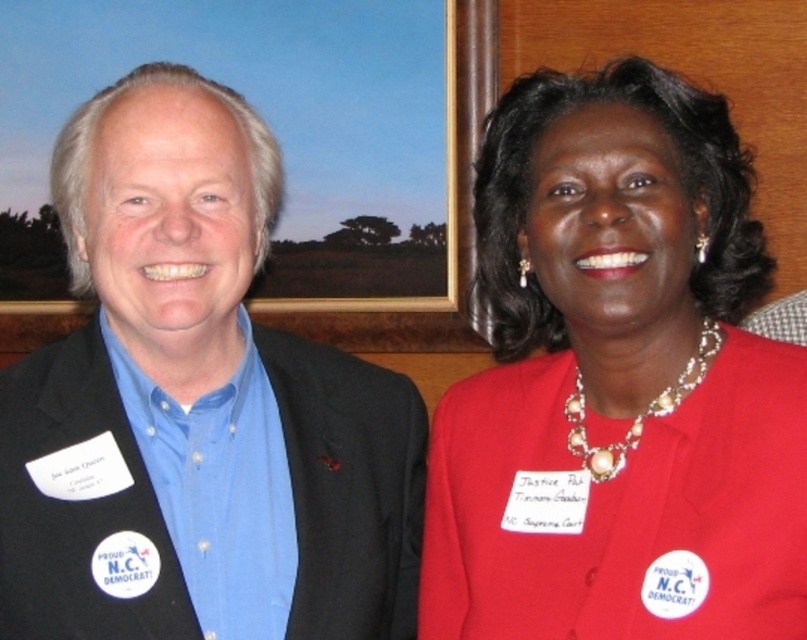
Is matte red blazer at center to the right of blue fabric shirt at center from the viewer's perspective?

Correct, you'll find matte red blazer at center to the right of blue fabric shirt at center.

Can you confirm if matte red blazer at center is wider than blue fabric shirt at center?

In fact, matte red blazer at center might be narrower than blue fabric shirt at center.

What do you see at coordinates (617, 381) in the screenshot? Image resolution: width=807 pixels, height=640 pixels. I see `matte red blazer at center` at bounding box center [617, 381].

This screenshot has width=807, height=640. Identify the location of matte red blazer at center. (617, 381).